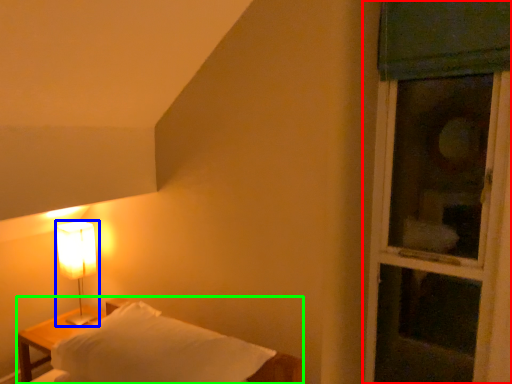
Question: Based on their relative distances, which object is nearer to window (highlighted by a red box)? Choose from lamp (highlighted by a blue box) and furniture (highlighted by a green box).

Choices:
 (A) lamp
 (B) furniture

Answer: (B)